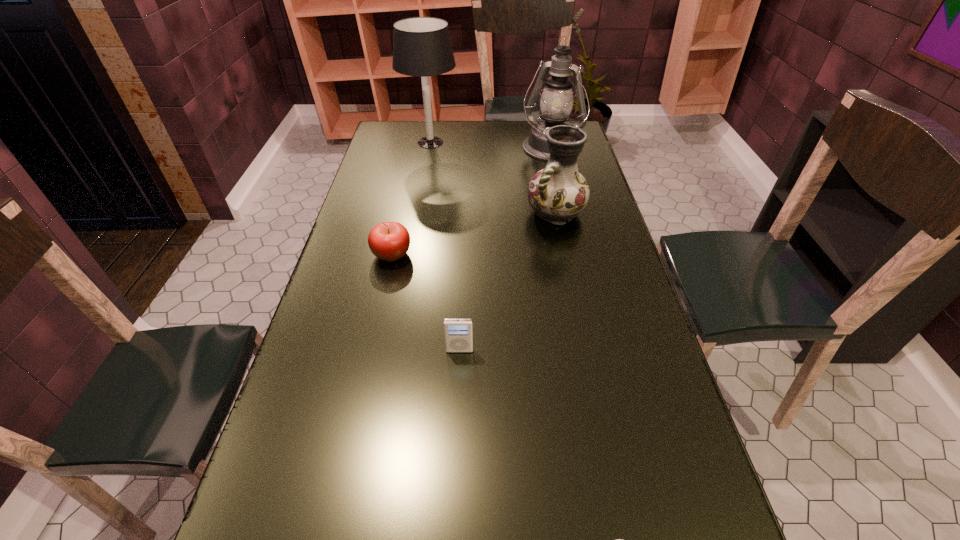
Where is `the fourth closest object relative to the nearest object`? The height and width of the screenshot is (540, 960). the fourth closest object relative to the nearest object is located at coordinates (556, 103).